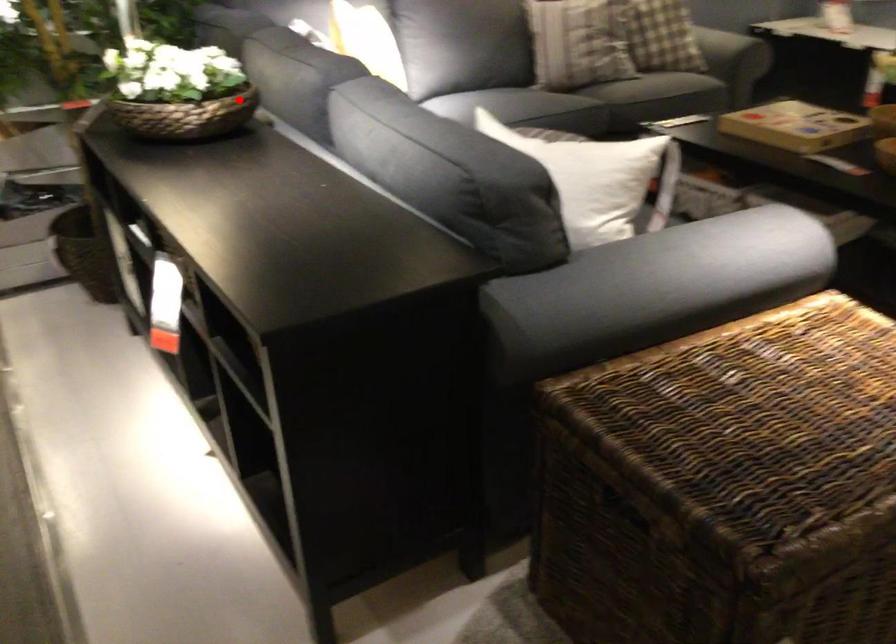
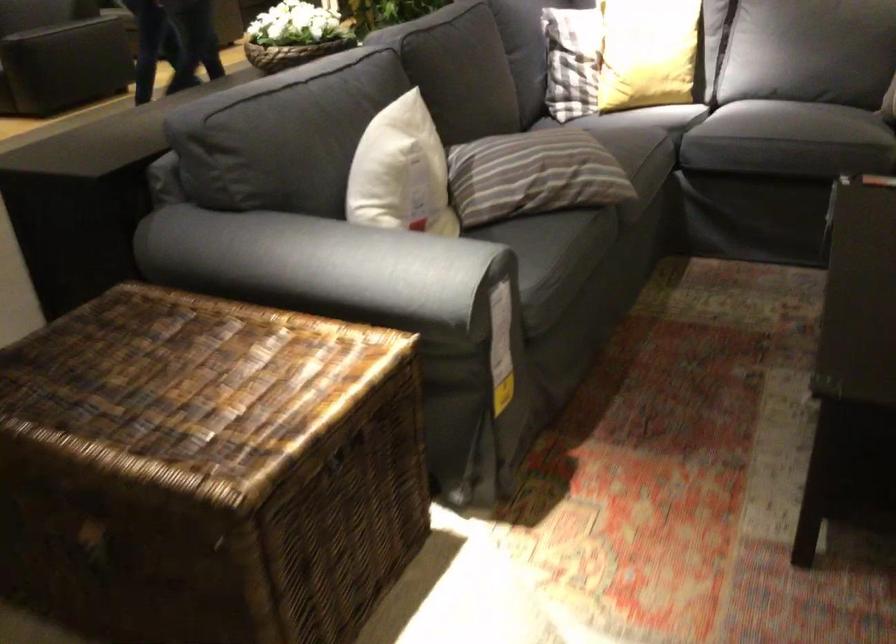
The point at the highlighted location is marked in the first image. Where is the corresponding point in the second image?

(291, 53)